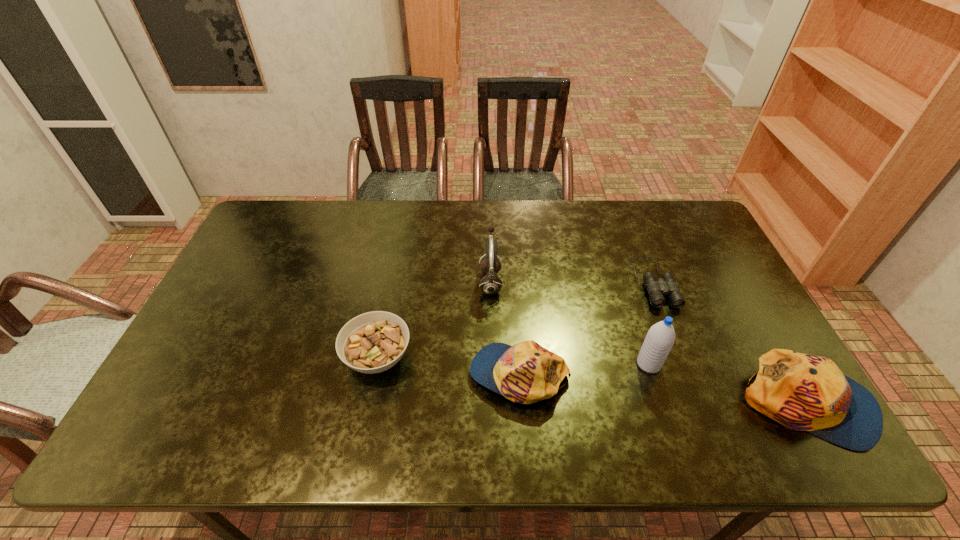
Locate an element on the screen. The height and width of the screenshot is (540, 960). object that is at the right edge is located at coordinates (x=804, y=392).

Image resolution: width=960 pixels, height=540 pixels. I want to click on object located in the near right corner section of the desktop, so click(x=804, y=392).

In the image, there is a desktop. Where is `vacant space at the far edge`? vacant space at the far edge is located at coordinates (397, 242).

Where is `vacant space at the near edge`? The height and width of the screenshot is (540, 960). vacant space at the near edge is located at coordinates (636, 391).

This screenshot has width=960, height=540. I want to click on free region at the left edge of the desktop, so click(272, 288).

The height and width of the screenshot is (540, 960). What are the coordinates of `vacant space at the right edge of the desktop` in the screenshot? It's located at [x=698, y=314].

Find the location of a particular element. free space at the far left corner of the desktop is located at coordinates tap(309, 211).

Locate an element on the screen. This screenshot has width=960, height=540. free point at the far right corner is located at coordinates (664, 207).

The image size is (960, 540). Identify the location of free area in between the water bottle and the earphone. (569, 323).

Where is `empty space between the fourth shortest object and the second shortest object`? The height and width of the screenshot is (540, 960). empty space between the fourth shortest object and the second shortest object is located at coordinates (592, 381).